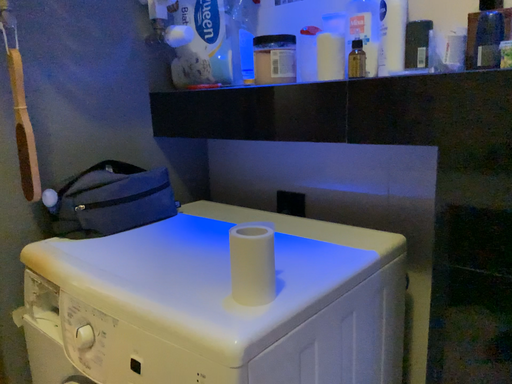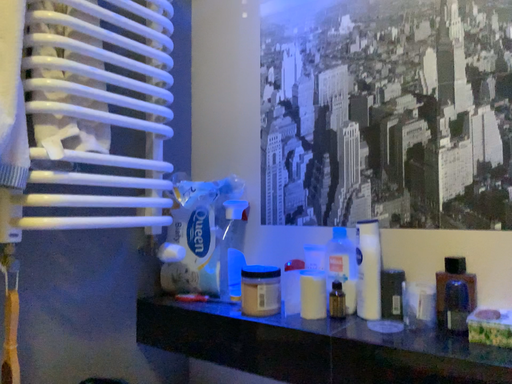
Question: Which way did the camera rotate in the video?

Choices:
 (A) rotated upward
 (B) rotated downward

Answer: (A)